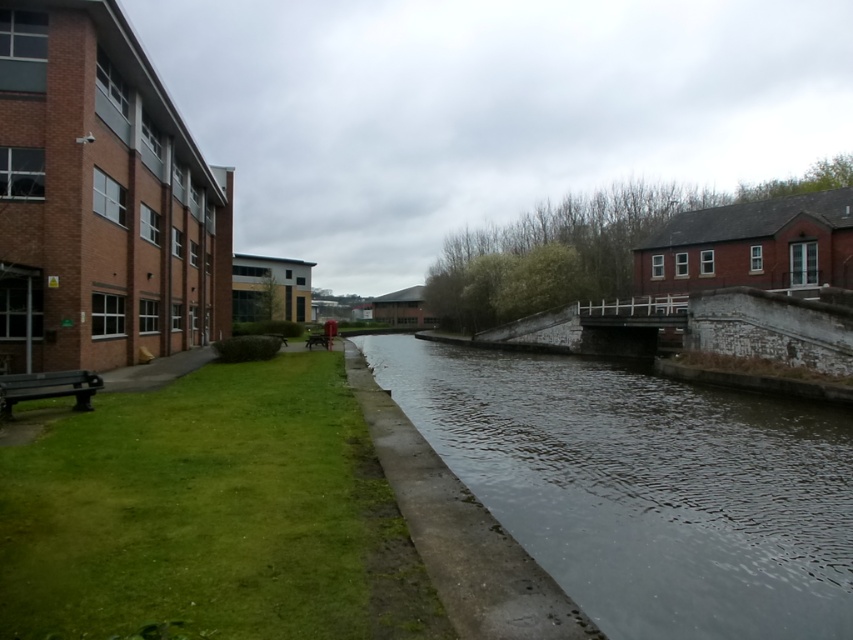
Looking at this image, does green grass at lower left have a greater height compared to clear water at center?

Incorrect, green grass at lower left's height is not larger of clear water at center's.

Is green grass at lower left below clear water at center?

No, green grass at lower left is not below clear water at center.

Is point (306, 433) closer to camera compared to point (480, 355)?

Yes, it is.

I want to click on green grass at lower left, so click(x=212, y=515).